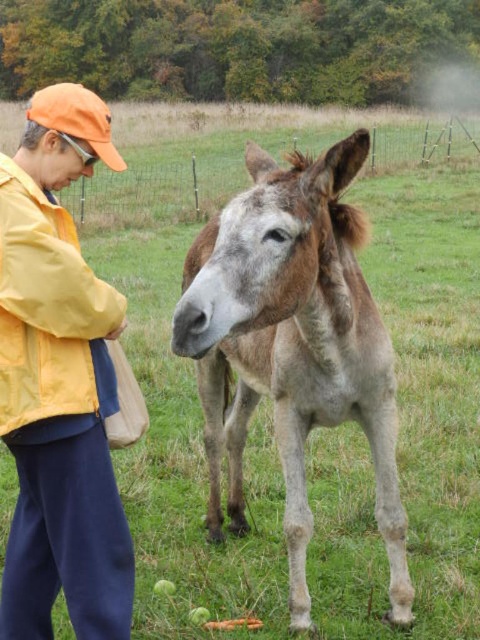
Can you confirm if fuzzy brown donkey at center is taller than orange fabric cap at upper left?

Indeed, fuzzy brown donkey at center has a greater height compared to orange fabric cap at upper left.

The width and height of the screenshot is (480, 640). I want to click on fuzzy brown donkey at center, so click(x=292, y=344).

You are a GUI agent. You are given a task and a screenshot of the screen. Output one action in this format:
    pyautogui.click(x=<x>, y=<y>)
    Task: Click on the fuzzy brown donkey at center
    The width and height of the screenshot is (480, 640).
    Given the screenshot: What is the action you would take?
    292,344